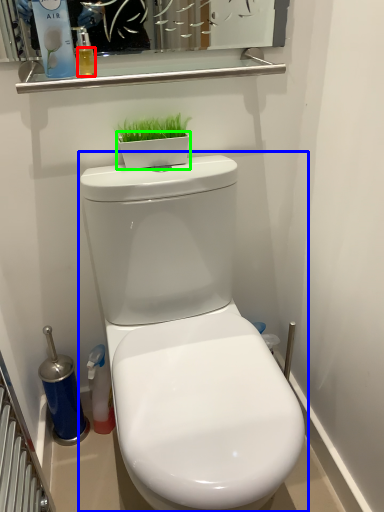
Question: Estimate the real-world distances between objects in this image. Which object is closer to liquid (highlighted by a red box), toilet (highlighted by a blue box) or flowerpot (highlighted by a green box)?

Choices:
 (A) toilet
 (B) flowerpot

Answer: (B)